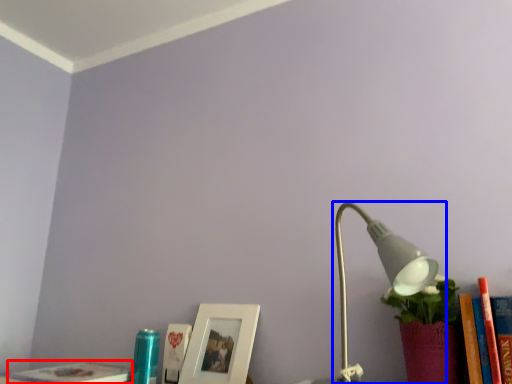
Question: Which object is closer to the camera taking this photo, book (highlighted by a red box) or lamp (highlighted by a blue box)?

Choices:
 (A) book
 (B) lamp

Answer: (B)